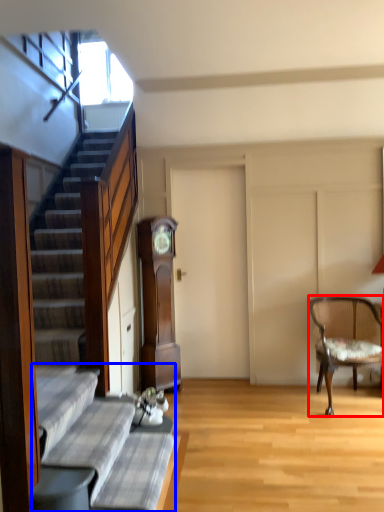
Question: Which point is closer to the camera, chair (highlighted by a red box) or couch (highlighted by a blue box)?

Choices:
 (A) chair
 (B) couch

Answer: (B)